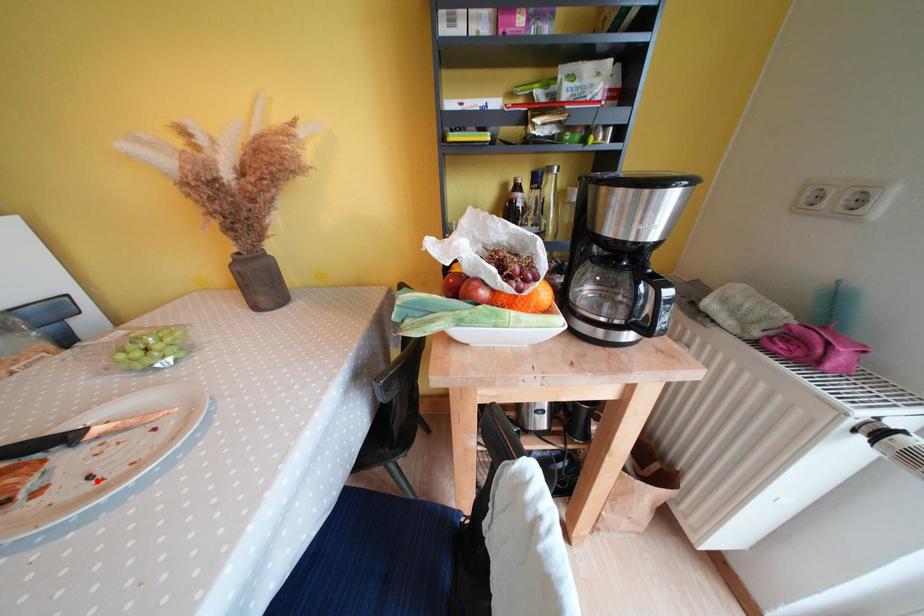
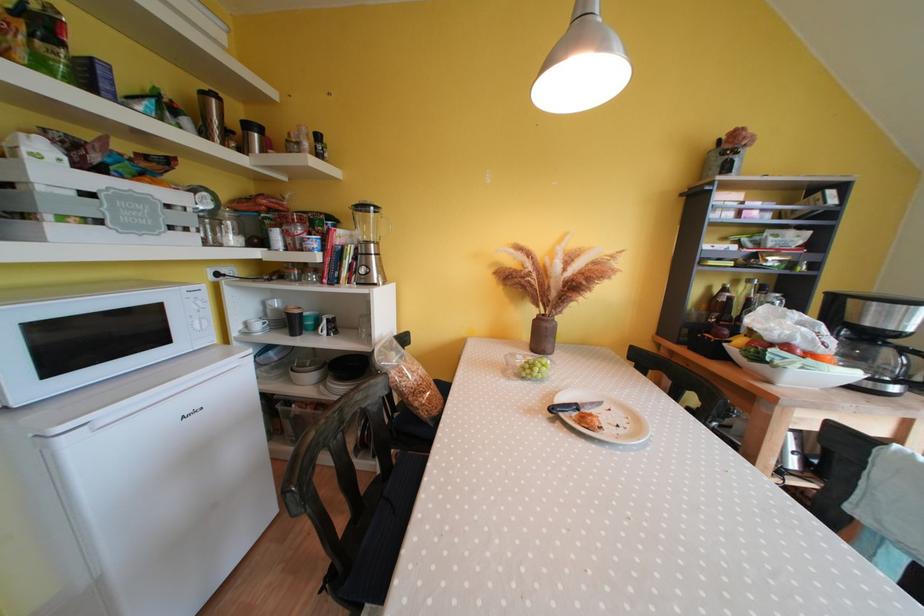
Question: I am providing you with two images of the same scene from different viewpoints. A red point is marked on the first image. At the location where the point appears in image 1, is it still visible in image 2?

Choices:
 (A) Yes
 (B) No

Answer: (A)